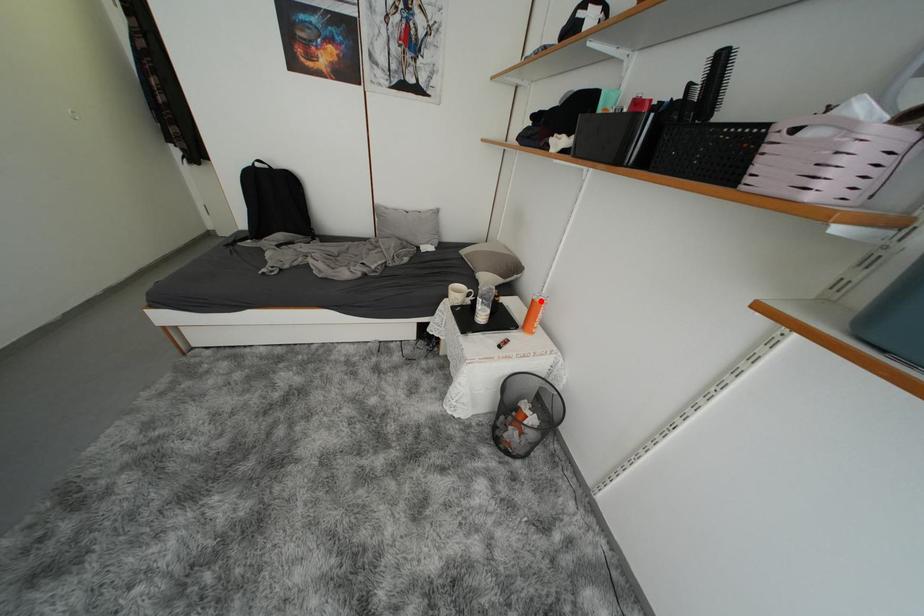
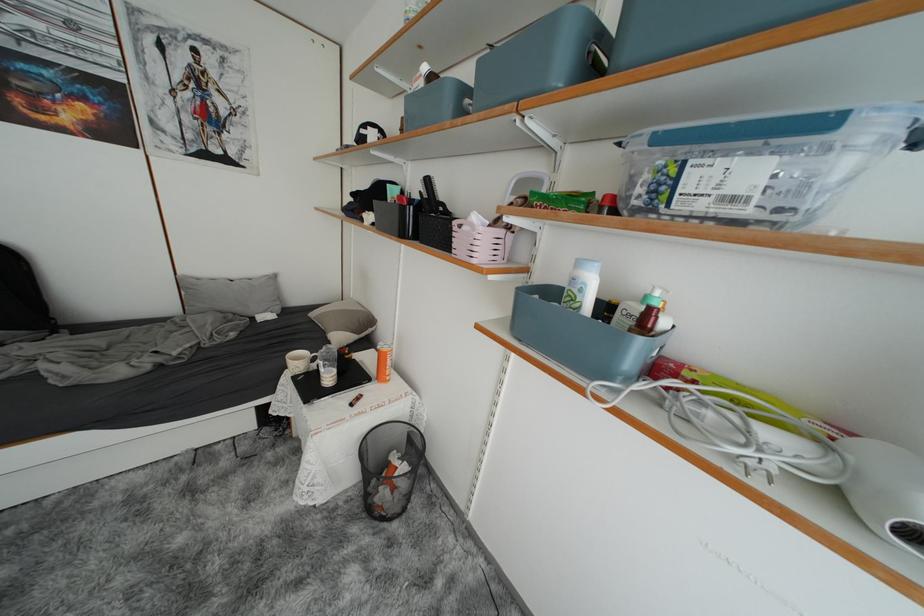
The point at the highlighted location is marked in the first image. Where is the corresponding point in the second image?

(385, 351)